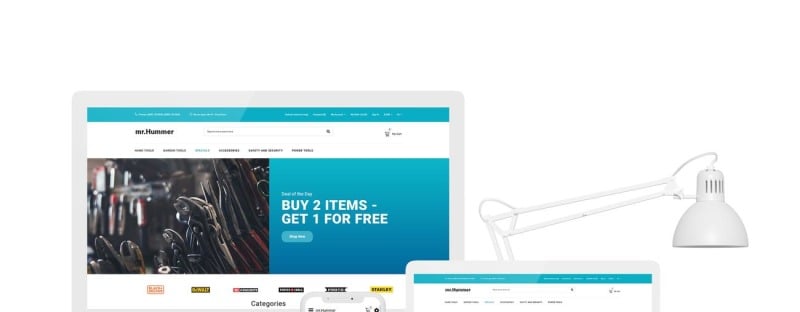
Find the location of a particular element. The height and width of the screenshot is (312, 800). lamp neck is located at coordinates (528, 208), (538, 223), (496, 248), (505, 248).